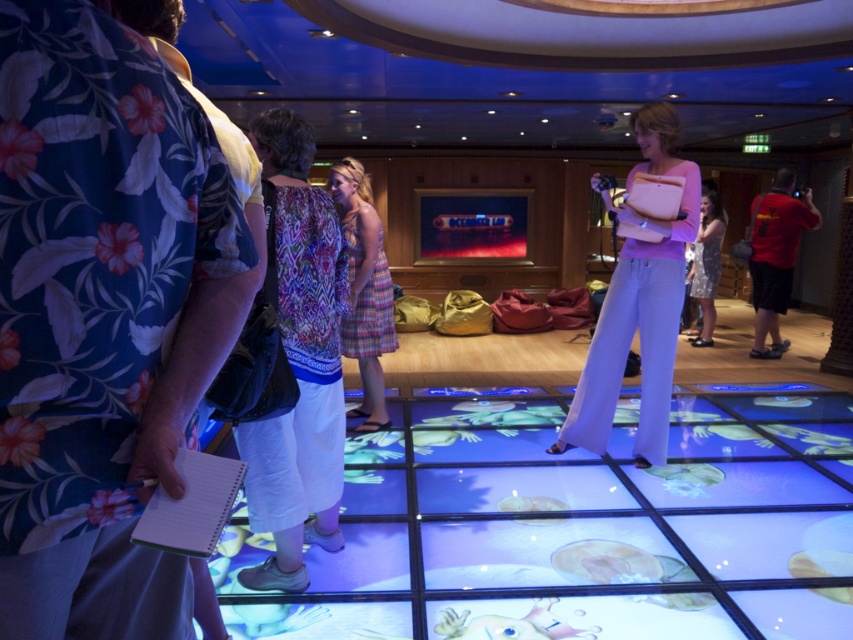
Question: Among these points, which one is nearest to the camera?

Choices:
 (A) (386, 328)
 (B) (762, 308)
 (C) (712, 200)

Answer: (A)

Question: Which point is farther from the camera taking this photo?

Choices:
 (A) (352, 326)
 (B) (782, 236)
 (C) (646, 458)

Answer: (B)

Question: Can you confirm if floral print shirt at upper left is positioned below pink fabric purse at center?

Choices:
 (A) no
 (B) yes

Answer: (B)

Question: Observing the image, what is the correct spatial positioning of floral print shirt at upper left in reference to printed fabric blouse at center?

Choices:
 (A) below
 (B) above

Answer: (B)

Question: Which of the following is the closest to the observer?

Choices:
 (A) pink fabric purse at center
 (B) printed fabric blouse at center

Answer: (B)

Question: Is the position of floral print shirt at upper left less distant than that of red shirt at right?

Choices:
 (A) yes
 (B) no

Answer: (A)